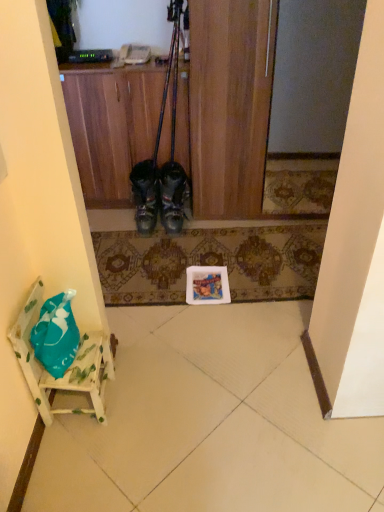
You are a GUI agent. You are given a task and a screenshot of the screen. Output one action in this format:
    pyautogui.click(x=<x>, y=<y>)
    Task: Click on the leather boots at center
    
    Given the screenshot: What is the action you would take?
    pyautogui.click(x=173, y=196)

This screenshot has width=384, height=512. What do you see at coordinates (173, 196) in the screenshot?
I see `leather boots at center` at bounding box center [173, 196].

What is the approximate width of leather boots at center?

leather boots at center is 10.78 inches in width.

The image size is (384, 512). What are the coordinates of `leather boots at center` in the screenshot? It's located at (173, 196).